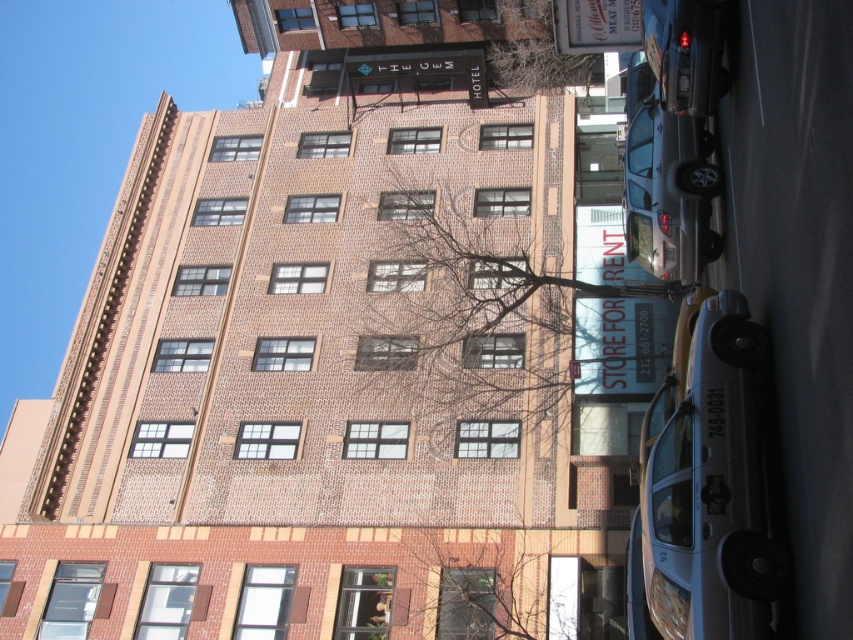
You are a pedestrian standing on the sidewalk in front of THE GEM HOTEL. You see a metallic silver taxi at lower right and a shiny black car at upper right. Which car is closer to you?

The metallic silver taxi at lower right is closer to you because it is positioned in front of the shiny black car at upper right.

You are a guest at THE GEM HOTEL and want to hail a taxi. You see the metallic silver taxi at lower right and the white plastic sign at upper center. According to the scene, which object is positioned more to the east?

The metallic silver taxi at lower right is positioned to the right of the white plastic sign at upper center. Since the scene is viewed from the front of the building, the right side corresponds to the east direction. Therefore, the metallic silver taxi at lower right is more to the east.

You are a delivery driver approaching THE GEM HOTEL. You see a shiny black car at upper right and a white plastic sign at upper center. Which object is closer to you as you arrive?

The shiny black car at upper right is closer to you because it is positioned in front of the white plastic sign at upper center.